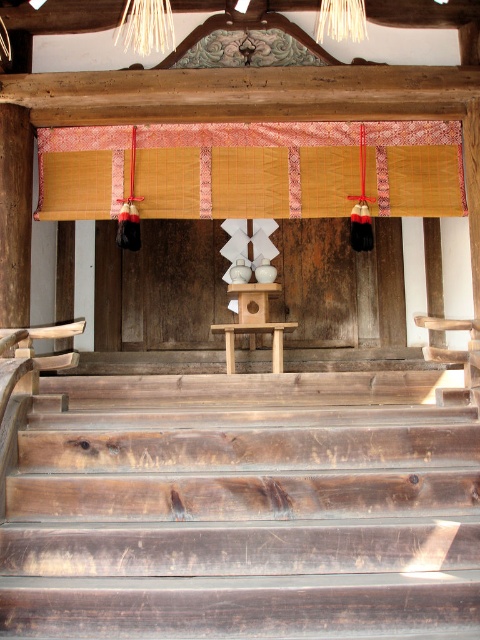
You are a visitor at the shrine and want to place a small offering on the bamboo mat at upper center. Considering the dark brown wood stairs at center, will you need to step sideways to reach the mat?

The dark brown wood stairs at center has a lesser width compared to bamboo mat at upper center, so you will need to step sideways to reach the bamboo mat at upper center as the stairs are narrower than the mat.

You are a visitor at the shrine and want to place a small offering on the bamboo mat at upper center. The dark brown wood stairs at center is in your way. Can you step onto the stairs to reach the mat?

The dark brown wood stairs at center is positioned under the bamboo mat at upper center, so you can step onto the stairs to reach the mat.